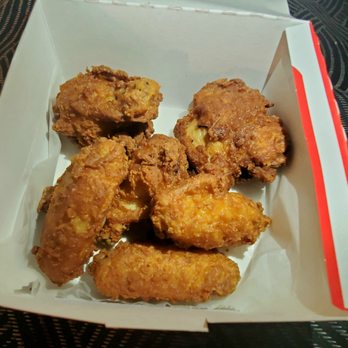
Locate an element on the screen. basket is located at coordinates (44, 331).